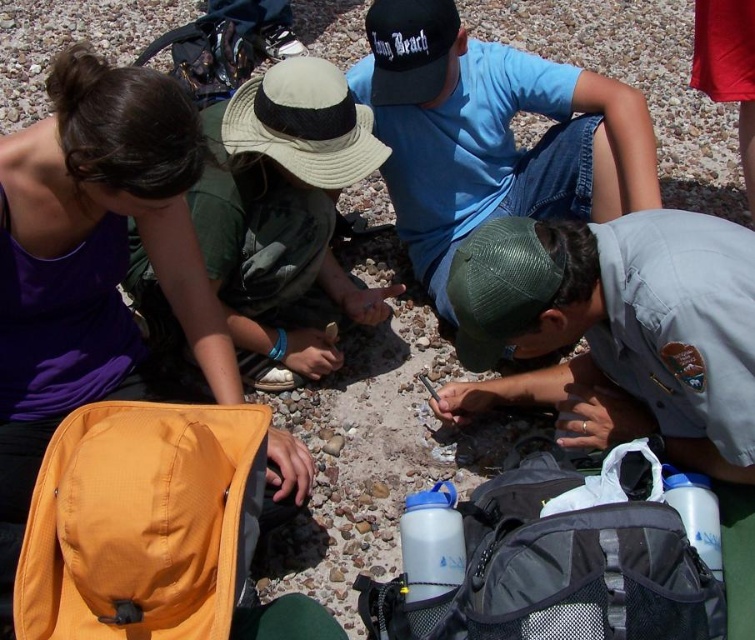
You are a photographer trying to capture a clear shot of both the green fabric hat at upper center and the black fabric baseball cap at upper center. Since you want both to be visible, which hat should you focus on first to ensure the larger one is in frame?

You should focus on the green fabric hat at upper center first because it has a larger size compared to the black fabric baseball cap at upper center, ensuring it fits within the frame before adjusting for the smaller one.

You are standing at the edge of the beach and see the blue cotton shirt at upper center and the green mesh baseball cap at center. If you want to reach both items, which one would you need to walk further to touch first?

The blue cotton shirt at upper center is taller than the green mesh baseball cap at center, so you would need to walk further to touch the blue cotton shirt at upper center first because it is farther away from your current position.

In the scene shown: You are a photographer trying to capture the green fabric hat at upper center in your shot. The camera you are using has a rectangular viewfinder with coordinates from 0 to 1 on both the x and y axes. To ensure the hat is centered in the frame, where should you position the center of your viewfinder?

The green fabric hat at upper center is located at point coordinates (x=284, y=218). To center it in the viewfinder, the center should be positioned at those coordinates.